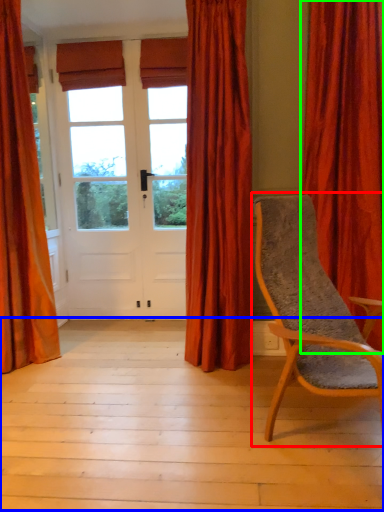
Question: Estimate the real-world distances between objects in this image. Which object is farther from chair (highlighted by a red box), porch (highlighted by a blue box) or curtain (highlighted by a green box)?

Choices:
 (A) porch
 (B) curtain

Answer: (B)